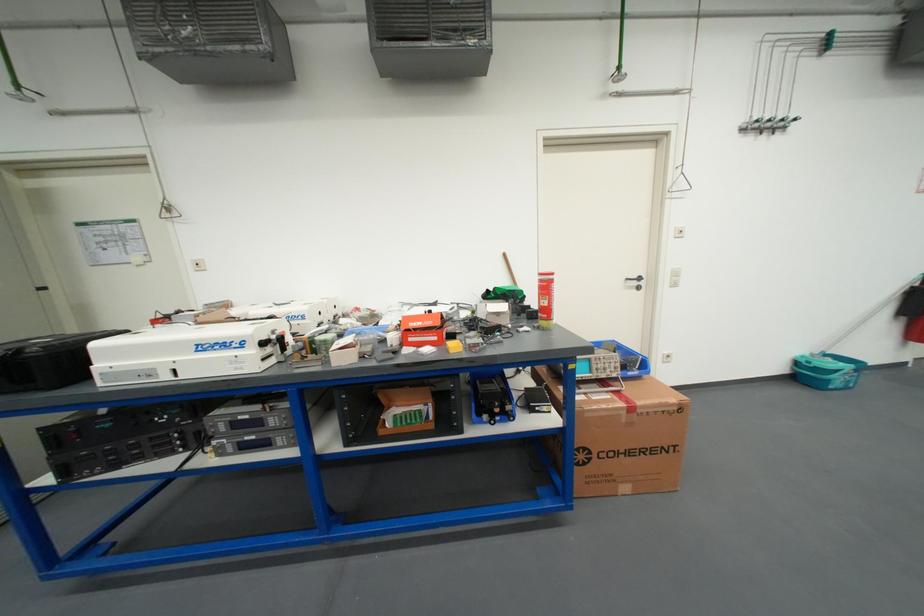
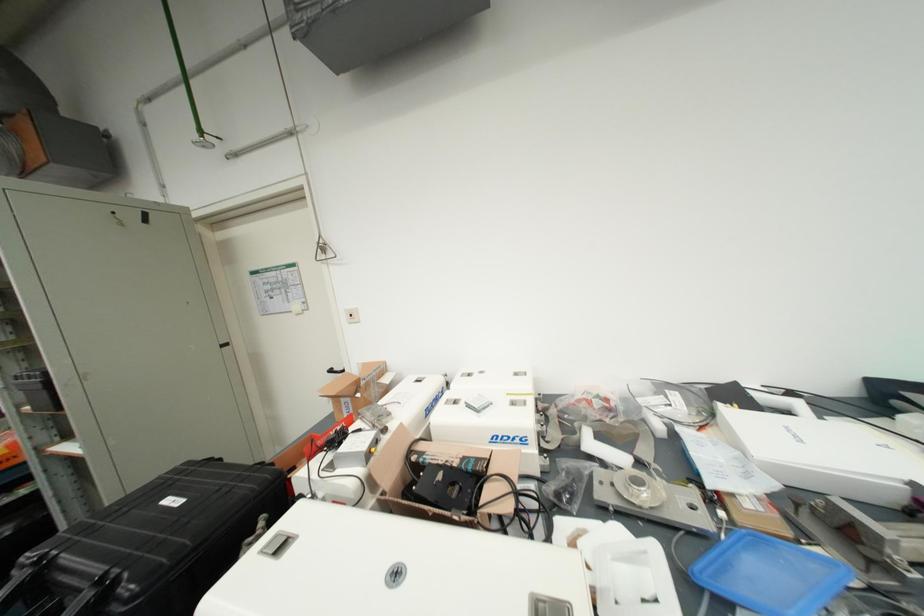
Find the pixel in the second image that matches pixel 202 267 in the first image.

(357, 318)